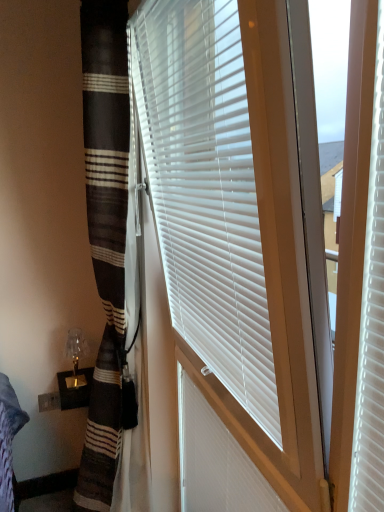
Question: Does translucent glass table lamp at lower left have a larger size compared to white plastic shutter at center?

Choices:
 (A) no
 (B) yes

Answer: (A)

Question: Is translucent glass table lamp at lower left facing towards white plastic shutter at center?

Choices:
 (A) yes
 (B) no

Answer: (B)

Question: Is translucent glass table lamp at lower left outside of white plastic shutter at center?

Choices:
 (A) no
 (B) yes

Answer: (B)

Question: Can you confirm if translucent glass table lamp at lower left is thinner than white plastic shutter at center?

Choices:
 (A) yes
 (B) no

Answer: (B)

Question: Would you say translucent glass table lamp at lower left is a long distance from white plastic shutter at center?

Choices:
 (A) no
 (B) yes

Answer: (A)

Question: Is white plastic shutter at center at the back of translucent glass table lamp at lower left?

Choices:
 (A) yes
 (B) no

Answer: (B)

Question: Is white plastic blinds at center wider than translucent glass table lamp at lower left?

Choices:
 (A) yes
 (B) no

Answer: (B)

Question: Is white plastic blinds at center next to translucent glass table lamp at lower left?

Choices:
 (A) no
 (B) yes

Answer: (A)

Question: Can you confirm if white plastic blinds at center is shorter than translucent glass table lamp at lower left?

Choices:
 (A) no
 (B) yes

Answer: (A)

Question: Can you confirm if white plastic blinds at center is bigger than translucent glass table lamp at lower left?

Choices:
 (A) yes
 (B) no

Answer: (A)

Question: Does white plastic blinds at center come in front of translucent glass table lamp at lower left?

Choices:
 (A) no
 (B) yes

Answer: (B)

Question: Is white plastic blinds at center oriented towards translucent glass table lamp at lower left?

Choices:
 (A) no
 (B) yes

Answer: (A)

Question: Could you tell me if white plastic shutter at center is turned towards translucent glass table lamp at lower left?

Choices:
 (A) yes
 (B) no

Answer: (B)